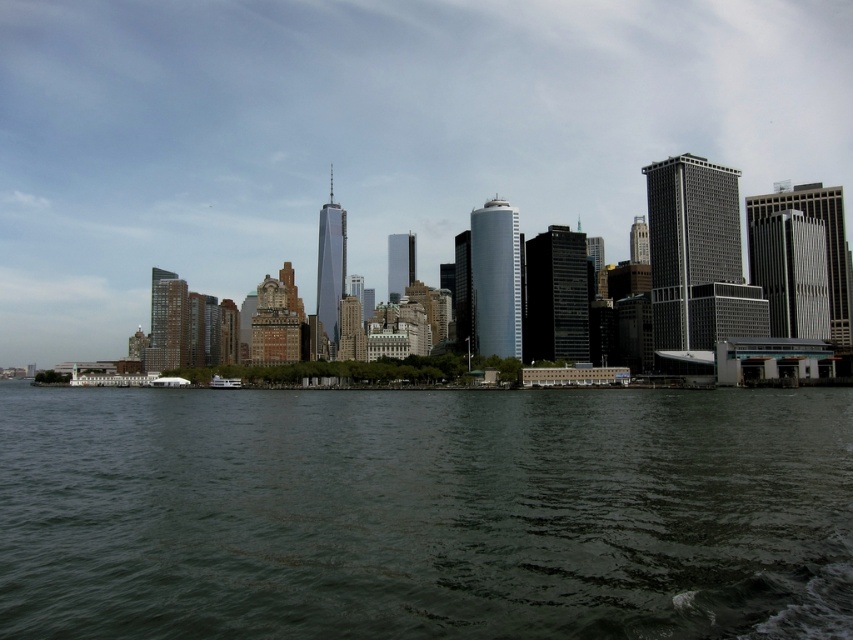
You are a photographer trying to capture a shot of the city skyline. You have a camera with a wide angle lens that can capture the entire scene. However, you want to ensure that the white glossy boat at center is visible to the left of the dark green water at center in your photo. Is this possible based on the scene description?

Yes, the dark green water at center is positioned on the right side of the white glossy boat at center, so the white glossy boat at center will naturally appear to the left of the dark green water at center in the photo.

In the scene shown: You are standing on the dock and see the transparent glass skyscraper at center and the white glossy boat at center. Which object is higher from the ground?

The transparent glass skyscraper at center is located above the white glossy boat at center, so it is higher from the ground.

You are standing on a pier and want to take a photo of the white glossy boat at center. However, the dark green water at center is blocking your view. Can you still see the boat through the water?

The dark green water at center is closer to the viewer than the white glossy boat at center, so the water is in front of the boat and blocking your view. You cannot see the boat through the water.